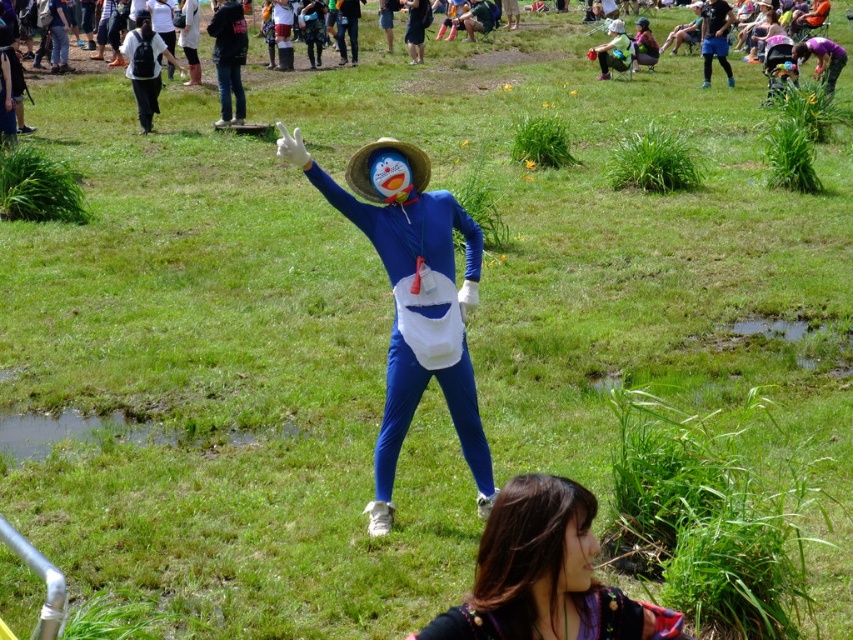
Is blue matte costume at center bigger than dark brown hair at lower center?

Yes, blue matte costume at center is bigger than dark brown hair at lower center.

Is point (413, 170) closer to camera compared to point (547, 556)?

No, (413, 170) is further to viewer.

Where is `blue matte costume at center`? This screenshot has height=640, width=853. blue matte costume at center is located at coordinates (412, 300).